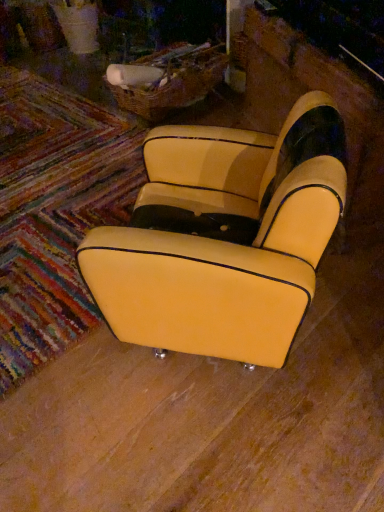
Locate an element on the screen. The image size is (384, 512). free point in front of yellow leather armchair at center is located at coordinates (216, 441).